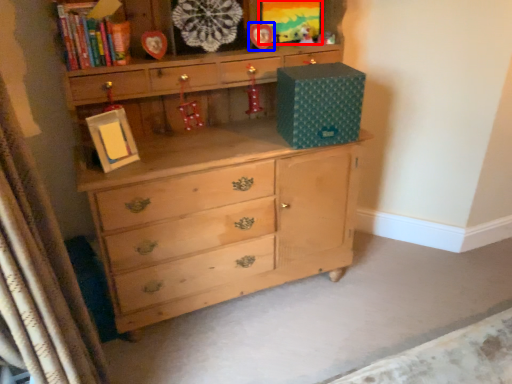
Question: Which object appears closest to the camera in this image, picture frame (highlighted by a red box) or picture frame (highlighted by a blue box)?

Choices:
 (A) picture frame
 (B) picture frame

Answer: (B)